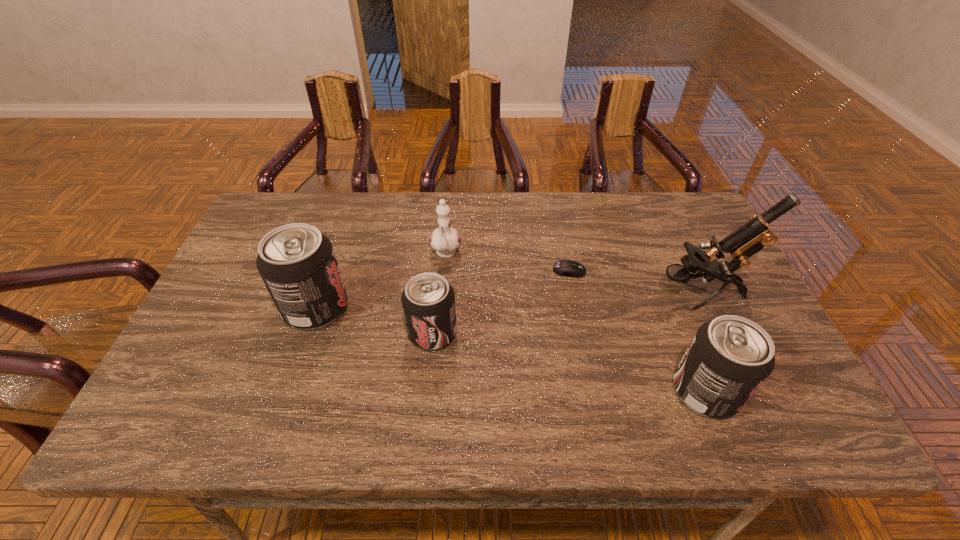
The width and height of the screenshot is (960, 540). Identify the location of the leftmost soda can. tap(297, 263).

Locate an element on the screen. The width and height of the screenshot is (960, 540). the shortest soda can is located at coordinates (428, 300).

Find the location of a particular element. the nearest object is located at coordinates pyautogui.click(x=728, y=359).

Locate an element on the screen. the rightmost soda can is located at coordinates (728, 359).

Where is `microscope`? The height and width of the screenshot is (540, 960). microscope is located at coordinates point(749,239).

Identify the location of the third object from right to left. The image size is (960, 540). (569, 268).

Locate an element on the screen. This screenshot has height=540, width=960. the shortest object is located at coordinates (569, 268).

Find the location of a particular element. The height and width of the screenshot is (540, 960). chinaware is located at coordinates (445, 240).

Where is `vacant space located 0.070m on the left of the leftmost object`? vacant space located 0.070m on the left of the leftmost object is located at coordinates click(257, 308).

You are a GUI agent. You are given a task and a screenshot of the screen. Output one action in this format:
    pyautogui.click(x=<x>, y=<y>)
    Task: Click on the free space located 0.200m on the left of the second soda can from left to right
    This screenshot has height=540, width=960.
    Given the screenshot: What is the action you would take?
    point(327,333)